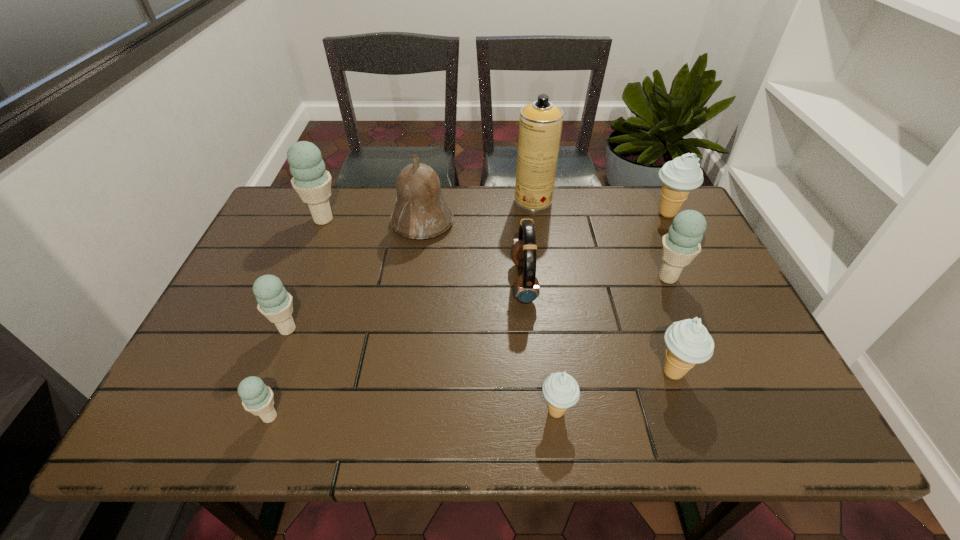
This screenshot has width=960, height=540. Identify the location of free space between the headset and the nearest beige icecream. (540, 347).

What are the coordinates of `vacant area that lies between the aerosol can and the rightmost beige icecream` in the screenshot? It's located at 600,207.

Where is `vacant space that's between the rightmost blue ice cream and the nearest blue ice cream`? This screenshot has height=540, width=960. vacant space that's between the rightmost blue ice cream and the nearest blue ice cream is located at coordinates (468, 347).

You are a GUI agent. You are given a task and a screenshot of the screen. Output one action in this format:
    pyautogui.click(x=<x>, y=<y>)
    Task: Click on the empty space that is in between the fourth ice cream from left to right and the second biggest beige icecream
    
    Given the screenshot: What is the action you would take?
    pyautogui.click(x=614, y=392)

Choose which object is the nearest neighbor to the seventh object from right to left. Please provide its 2D coordinates. Your answer should be formatted as a tuple, i.e. [(x, y)], where the tuple contains the x and y coordinates of a point satisfying the conditions above.

[(311, 181)]

Identify which object is located as the sixth nearest to the smallest blue ice cream. Please provide its 2D coordinates. Your answer should be formatted as a tuple, i.e. [(x, y)], where the tuple contains the x and y coordinates of a point satisfying the conditions above.

[(688, 342)]

Select which ice cream appears as the third closest to the headset. Please provide its 2D coordinates. Your answer should be formatted as a tuple, i.e. [(x, y)], where the tuple contains the x and y coordinates of a point satisfying the conditions above.

[(681, 244)]

Find the location of a particular element. Image resolution: width=960 pixels, height=540 pixels. the third closest ice cream to the brown headset is located at coordinates click(681, 244).

Point out which blue ice cream is positioned as the nearest to the fifth nearest ice cream. Please provide its 2D coordinates. Your answer should be formatted as a tuple, i.e. [(x, y)], where the tuple contains the x and y coordinates of a point satisfying the conditions above.

[(274, 302)]

Identify which blue ice cream is located as the third nearest to the brown headset. Please provide its 2D coordinates. Your answer should be formatted as a tuple, i.e. [(x, y)], where the tuple contains the x and y coordinates of a point satisfying the conditions above.

[(311, 181)]